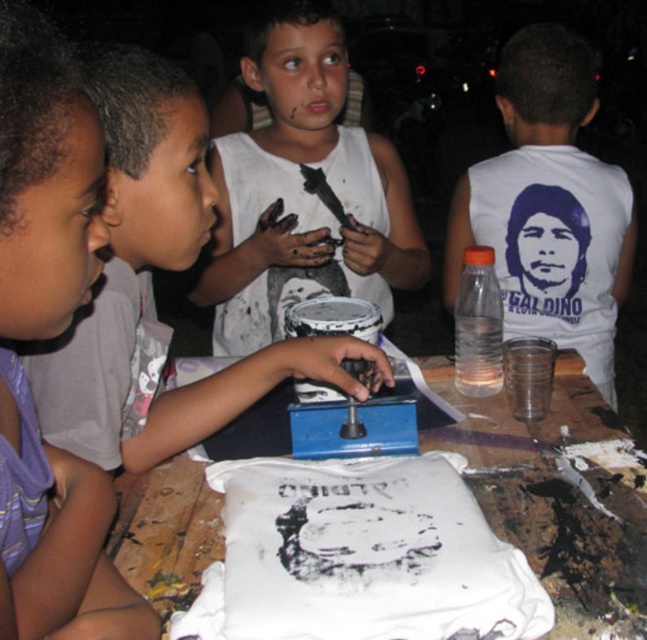
You are a teacher supervising the children during the screen printing activity. You notice two white shirts on the table. How far apart are the matte white shirt at center and the white matte shirt at center?

The matte white shirt at center and the white matte shirt at center are 79.02 centimeters apart from each other.